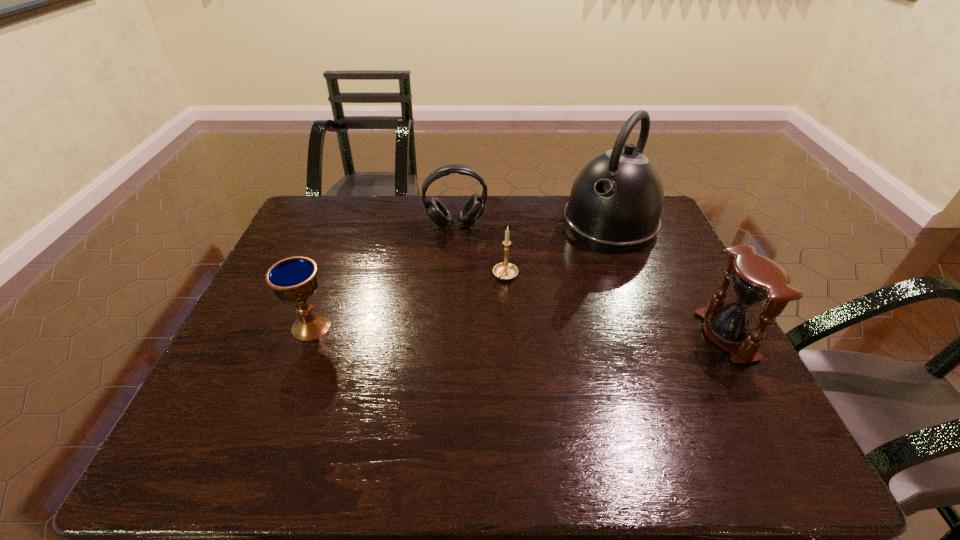
The width and height of the screenshot is (960, 540). I want to click on the leftmost object, so click(x=294, y=279).

Locate an element on the screen. The height and width of the screenshot is (540, 960). hourglass is located at coordinates (754, 279).

In order to click on headset in this screenshot , I will do `click(473, 208)`.

This screenshot has height=540, width=960. What are the coordinates of `the third farthest object` in the screenshot? It's located at (505, 270).

I want to click on the third object from right to left, so click(x=505, y=270).

Where is `kettle`? The height and width of the screenshot is (540, 960). kettle is located at coordinates (615, 204).

Where is `blank area located 0.290m on the back of the leftmost object`? blank area located 0.290m on the back of the leftmost object is located at coordinates (343, 241).

Where is `blank space located 0.050m on the left of the hourglass`? This screenshot has height=540, width=960. blank space located 0.050m on the left of the hourglass is located at coordinates (684, 335).

What are the coordinates of `vacant space situated 0.150m on the earcups of the second object from left to right` in the screenshot? It's located at (465, 264).

Where is `vacant space located on the earcups of the second object from left to right`? This screenshot has width=960, height=540. vacant space located on the earcups of the second object from left to right is located at coordinates click(471, 300).